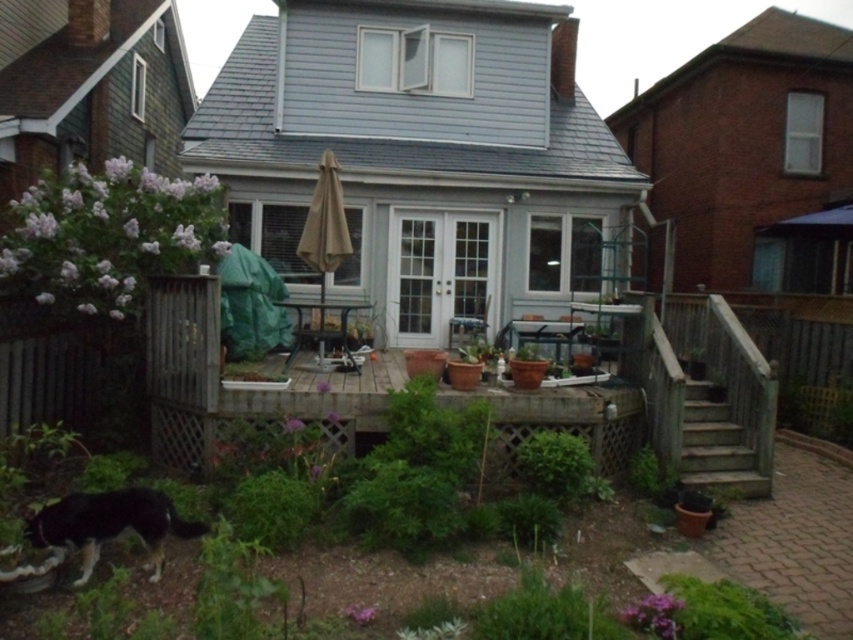
Question: Which is farther from the black fur dog at lower left?

Choices:
 (A) beige fabric umbrella at center
 (B) wooden stairs at lower right

Answer: (B)

Question: Which of these objects is positioned farthest from the black fur dog at lower left?

Choices:
 (A) beige fabric umbrella at center
 (B) wooden stairs at lower right

Answer: (B)

Question: Is black fur dog at lower left to the left of beige fabric umbrella at center from the viewer's perspective?

Choices:
 (A) no
 (B) yes

Answer: (B)

Question: From the image, what is the correct spatial relationship of black fur dog at lower left in relation to wooden stairs at lower right?

Choices:
 (A) below
 (B) above

Answer: (A)

Question: Does black fur dog at lower left have a greater width compared to beige fabric umbrella at center?

Choices:
 (A) no
 (B) yes

Answer: (B)

Question: Which of the following is the farthest from the observer?

Choices:
 (A) (160, 570)
 (B) (753, 488)

Answer: (B)